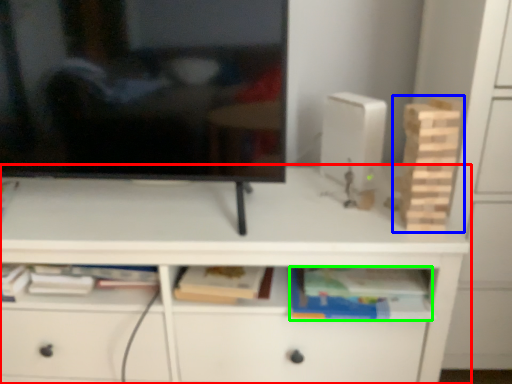
Question: Which is farther away from desk (highlighted by a red box)? toy (highlighted by a blue box) or book (highlighted by a green box)?

Choices:
 (A) toy
 (B) book

Answer: (A)